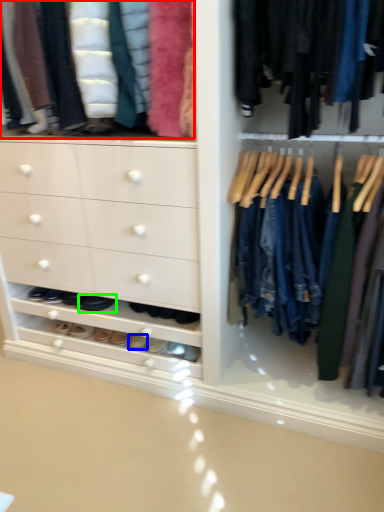
Question: Which object is the farthest from clothing (highlighted by a red box)? Choose among these: footwear (highlighted by a blue box) or footwear (highlighted by a green box).

Choices:
 (A) footwear
 (B) footwear

Answer: (A)